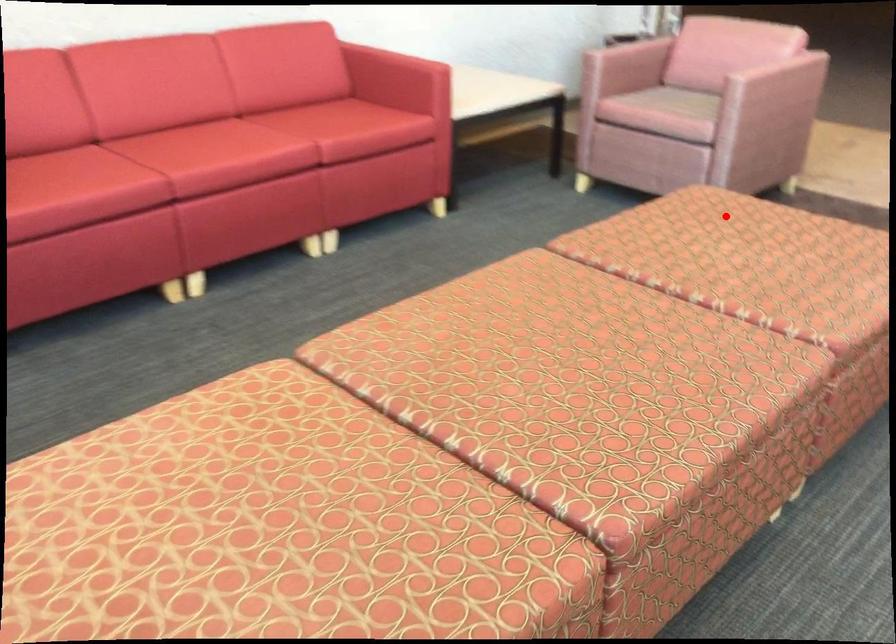
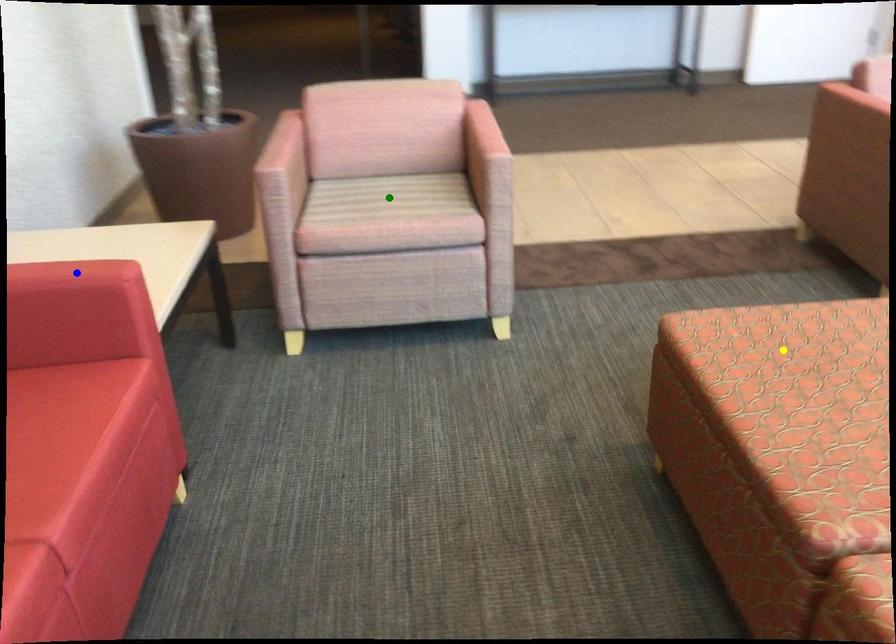
Question: I am providing you with two images of the same scene from different viewpoints. A red point is marked on the first image. You are given multiple points on the second image. Which point in image 2 represents the same 3d spot as the red point in image 1?

Choices:
 (A) blue point
 (B) green point
 (C) yellow point

Answer: (C)